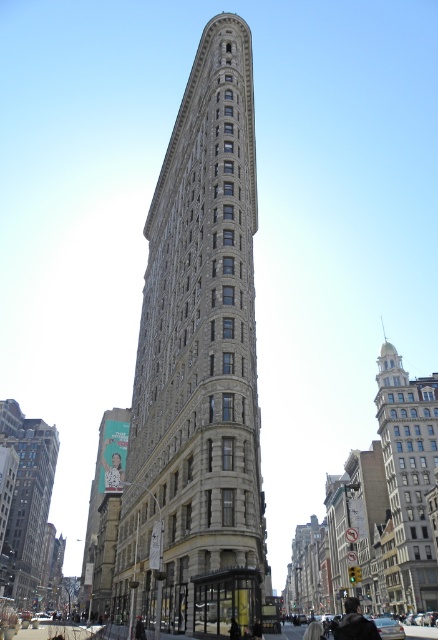
Based on the photo, you are standing on the sidewalk in front of the two buildings. The stone textured building at center and the silver metallic building at right are both visible. Which building takes up more space in your view?

The silver metallic building at right takes up more space in your view because it occupies more area than the stone textured building at center according to the description.

You are standing on the sidewalk in front of the stone textured building at center. If you want to take a photo that captures the entire building in one frame, how far back do you need to step?

The stone textured building at center is 153.10 feet from viewer. To capture the entire building in one frame, you would need to step back to a distance of approximately 153.10 feet from the building.

You are standing on the sidewalk in front of the Flatiron Building. You notice two buildings in the scene. Which one is closer to you, the stone textured building at center or the gray stone building at center?

The stone textured building at center is closer to you because it is in front of the gray stone building at center.